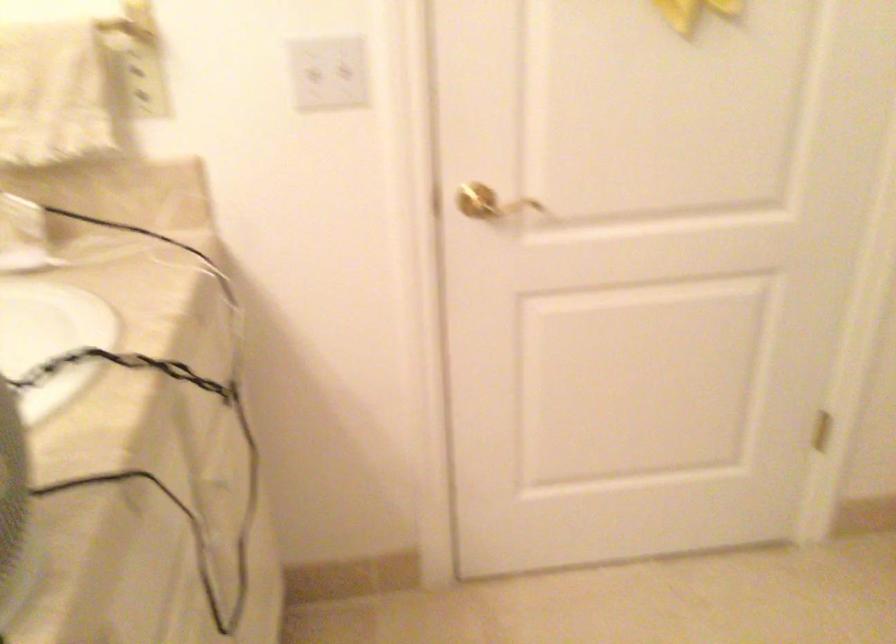
Find where to turn the brass door handle. Please return your answer as a coordinate pair (x, y).

(489, 203)